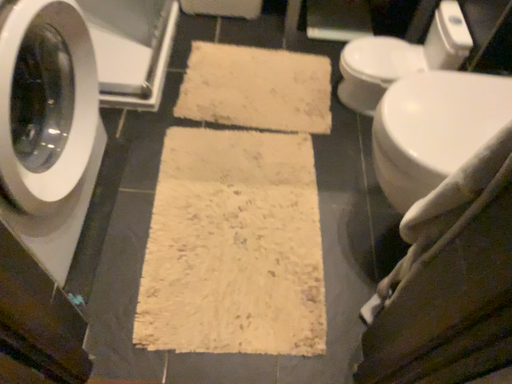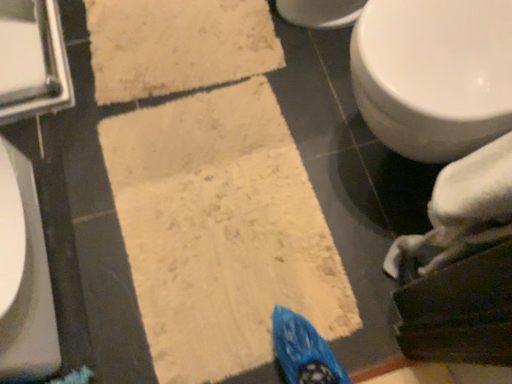
Question: Which way did the camera rotate in the video?

Choices:
 (A) rotated left
 (B) rotated right

Answer: (B)